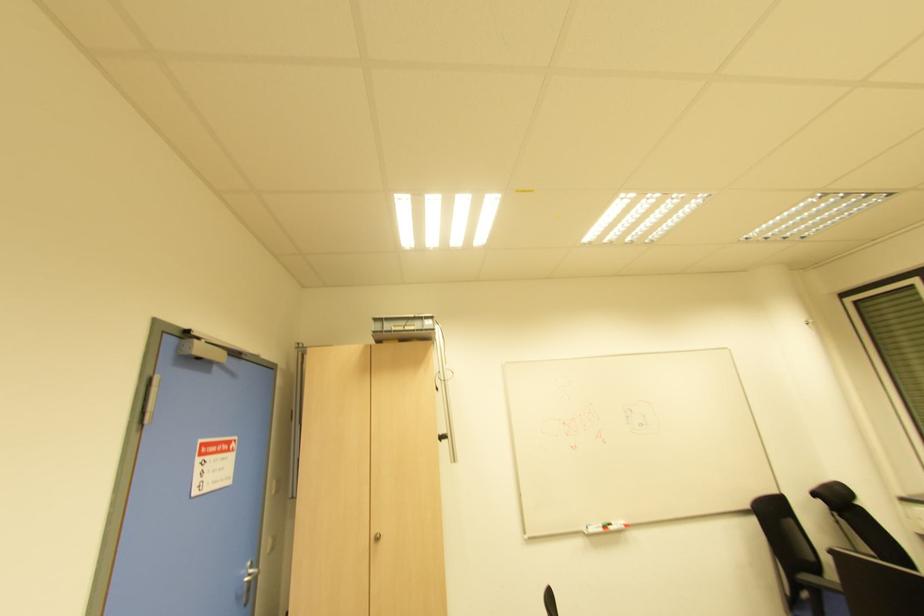
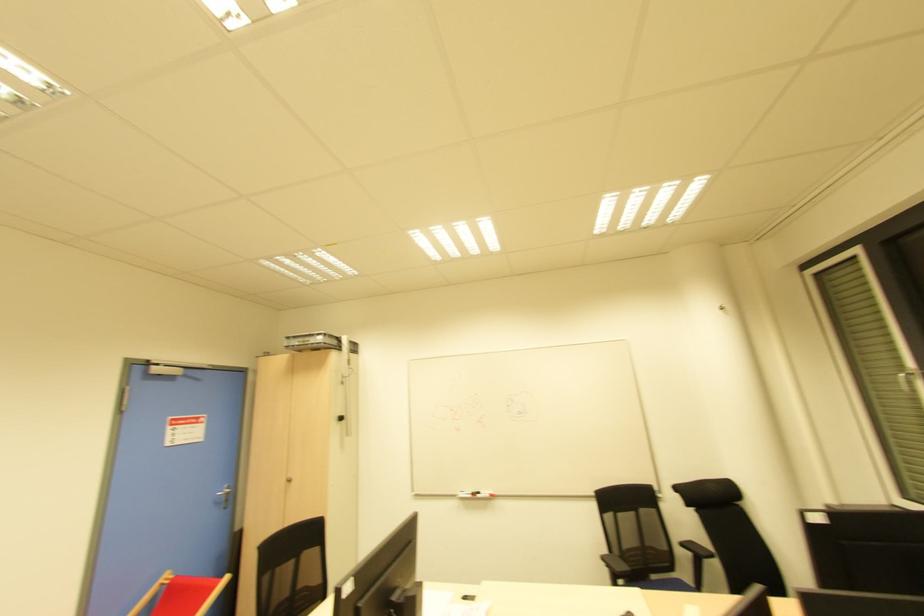
Locate, in the second image, the point that corresponds to [373,334] in the first image.

(286, 347)